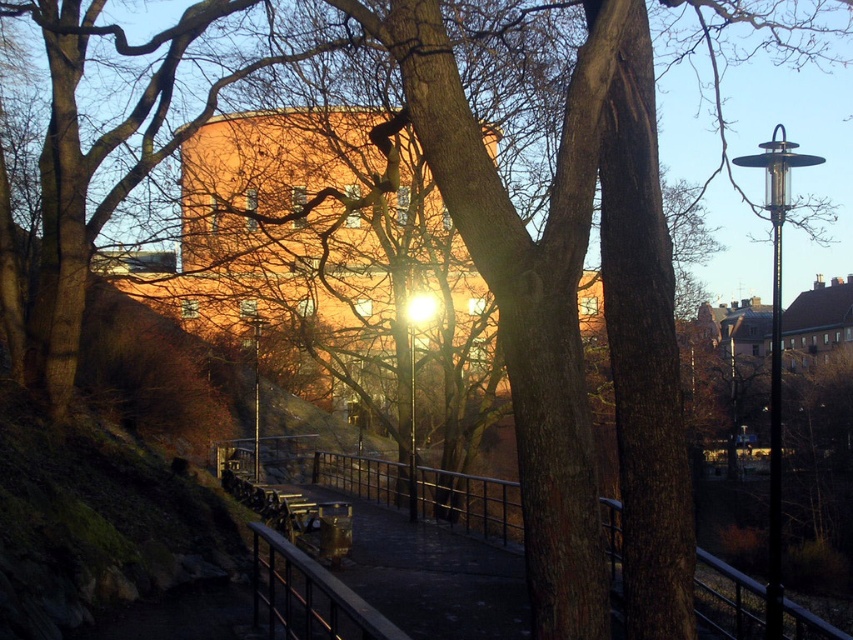
You are standing at the point marked as point (471, 502) in the image. What object are you currently standing on?

You are standing on the metallic gray rail at center.

You are standing on the paved pathway and want to reach the orange building in the background. Which object, the metallic gray rail at center or the metallic glass lamp post at center, would you encounter first as you walk towards the orange building?

You would encounter the metallic gray rail at center first because it is closer to the viewer than the metallic glass lamp post at center, which is further away.

You are a pedestrian walking along the paved pathway in the scene. You notice the metallic gray rail at center and the metallic pole at center. Which object is closer to you as you walk along the path?

The metallic gray rail at center is closer to you because it is positioned in front of the metallic pole at center.